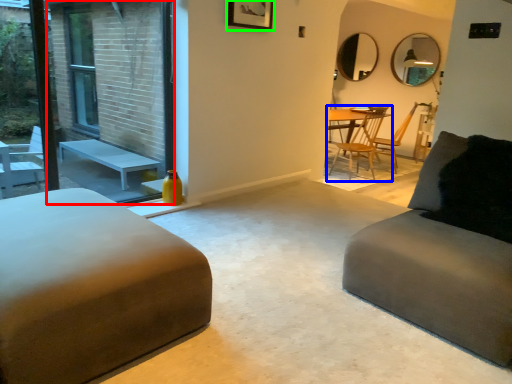
Question: Based on their relative distances, which object is farther from screen door (highlighted by a red box)? Choose from chair (highlighted by a blue box) and picture frame (highlighted by a green box).

Choices:
 (A) chair
 (B) picture frame

Answer: (A)